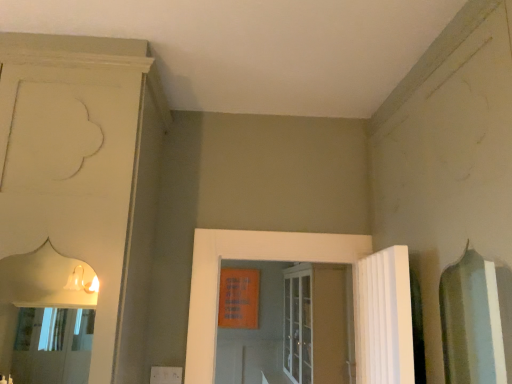
The width and height of the screenshot is (512, 384). Describe the element at coordinates (315, 324) in the screenshot. I see `matte glass cabinet at center` at that location.

The image size is (512, 384). I want to click on matte glass cabinet at center, so click(315, 324).

In order to face matte glass cabinet at center, should I rotate leftwards or rightwards?

To align with it, rotate right about 5.302°.

At what (x,y) coordinates should I click in order to perform the action: click on matte glass cabinet at center. Please return your answer as a coordinate pair (x, y). Looking at the image, I should click on [x=315, y=324].